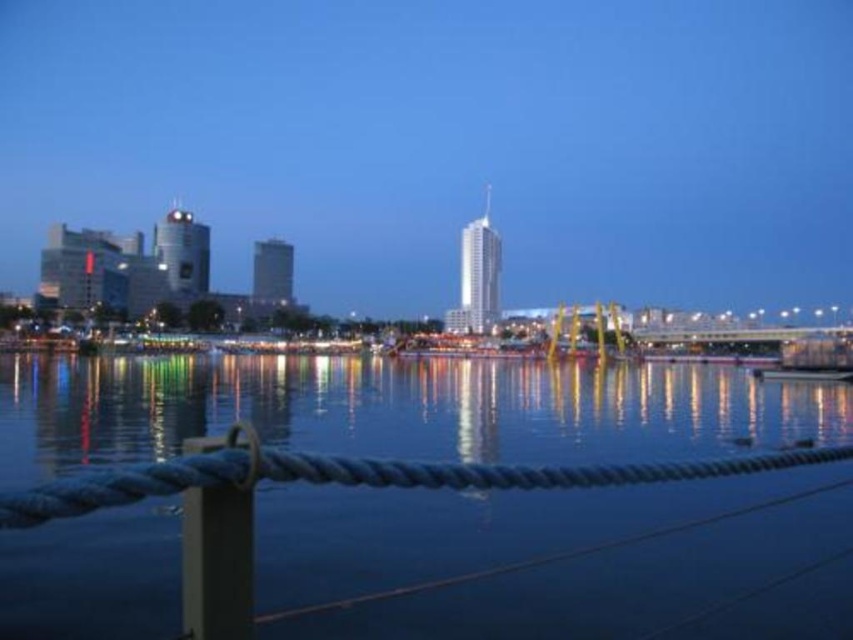
Is dark blue water at center bigger than metallic gray pole at lower left?

Yes, dark blue water at center is bigger than metallic gray pole at lower left.

Does dark blue water at center appear over metallic gray pole at lower left?

Actually, dark blue water at center is below metallic gray pole at lower left.

Where is `dark blue water at center`? The image size is (853, 640). dark blue water at center is located at coordinates (399, 410).

At what (x,y) coordinates should I click in order to perform the action: click on dark blue water at center. Please return your answer as a coordinate pair (x, y). This screenshot has width=853, height=640. Looking at the image, I should click on (399, 410).